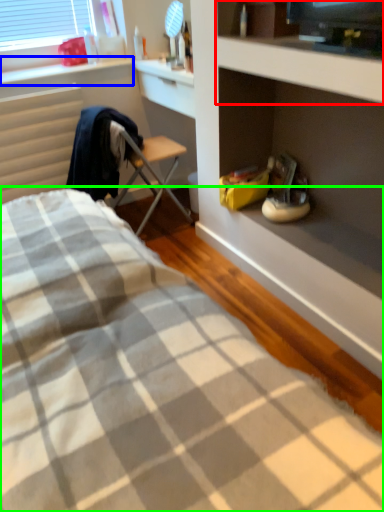
Question: Which is nearer to the cabinet (highlighted by a red box)? window sill (highlighted by a blue box) or bed (highlighted by a green box).

Choices:
 (A) window sill
 (B) bed

Answer: (B)